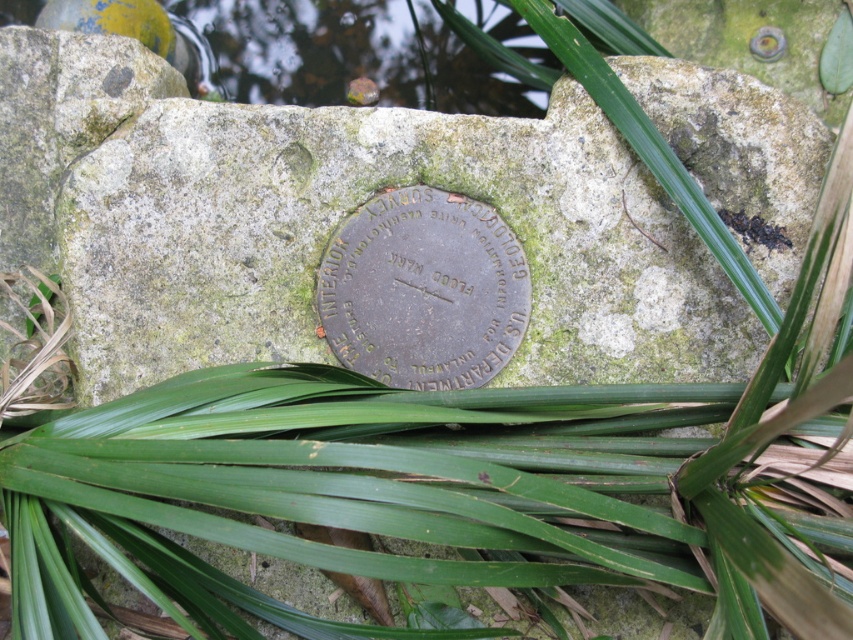
Question: Does green mossy stone at center have a larger size compared to bronze metallic plaque at center?

Choices:
 (A) no
 (B) yes

Answer: (B)

Question: Is green mossy stone at center bigger than bronze metallic plaque at center?

Choices:
 (A) yes
 (B) no

Answer: (A)

Question: Does green mossy stone at center appear on the left side of bronze metallic plaque at center?

Choices:
 (A) yes
 (B) no

Answer: (B)

Question: Among these objects, which one is farthest from the camera?

Choices:
 (A) green mossy stone at center
 (B) bronze metallic plaque at center

Answer: (B)